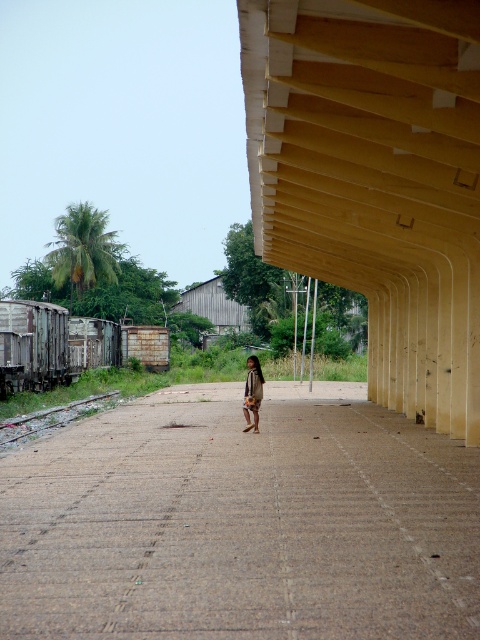
You are a construction worker needing to place a 3 meter wide equipment on the brown textured pavement at center or the yellow wood shelter at center. Which location can accommodate the equipment based on their widths?

The brown textured pavement at center has a larger width than the yellow wood shelter at center, so the equipment can be placed on the brown textured pavement at center.